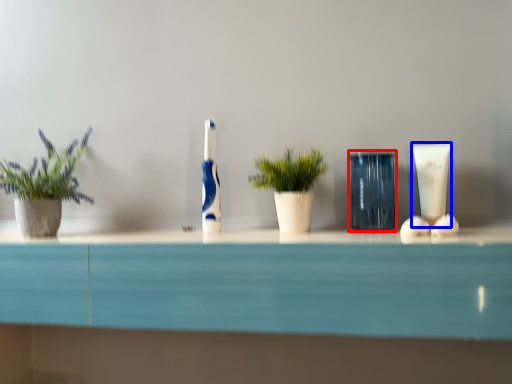
Question: Which point is further to the camera, glass vase (highlighted by a red box) or toiletry (highlighted by a blue box)?

Choices:
 (A) glass vase
 (B) toiletry

Answer: (B)